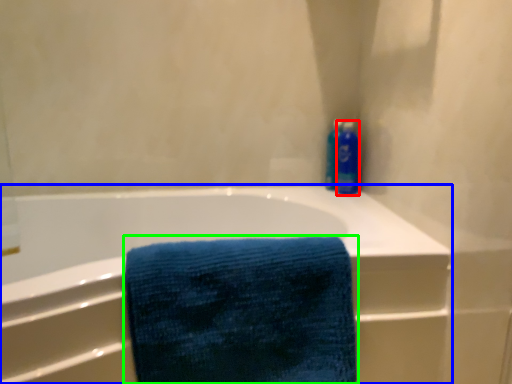
Question: Which object is positioned closest to cleaning product (highlighted by a red box)? Select from bathtub (highlighted by a blue box) and towel (highlighted by a green box).

Choices:
 (A) bathtub
 (B) towel

Answer: (A)